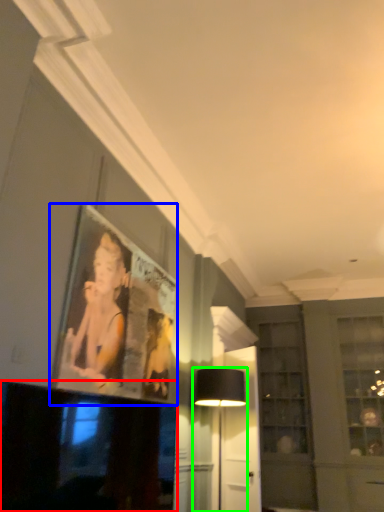
Question: Based on their relative distances, which object is nearer to television (highlighted by a red box)? Choose from picture frame (highlighted by a blue box) and table lamp (highlighted by a green box).

Choices:
 (A) picture frame
 (B) table lamp

Answer: (A)